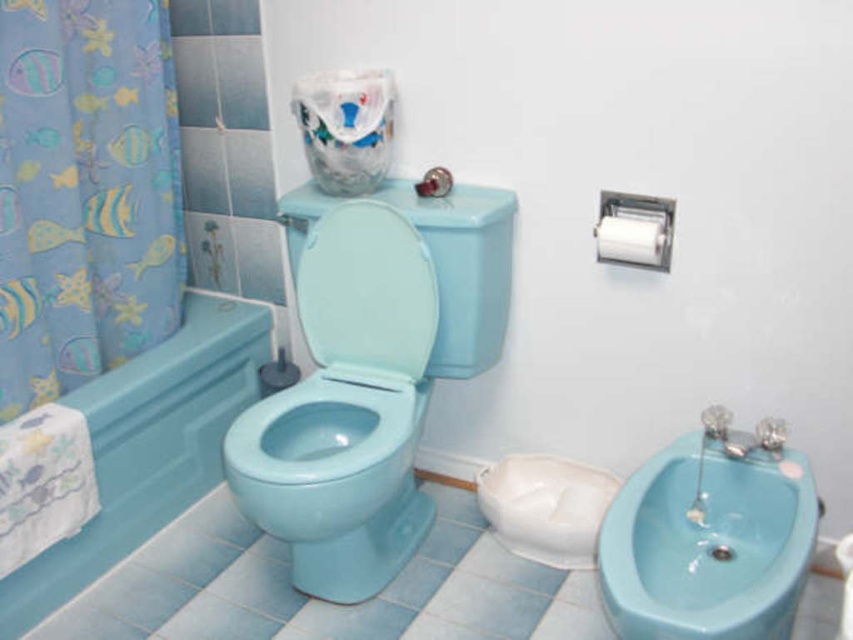
You are a plumber trying to install a new bidet. You have a space that can accommodate a width of 30 cm. According to the image, can the matte blue bidet at lower right fit in the space if the matte ceramic bathtub at lower left is 25 cm wide?

The matte blue bidet at lower right might be wider than the matte ceramic bathtub at lower left, which is 25 cm wide. Therefore, the bidet could be wider than 25 cm, so it may not fit in the 30 cm space unless its exact width is confirmed.

You are standing in the bathroom and need to locate the matte ceramic bathtub at lower left. According to the coordinates provided, where exactly is it positioned?

The matte ceramic bathtub at lower left is positioned at the 2D coordinates point (148, 445).

You are a bathroom designer planning to place a new rectangular shelf between the matte ceramic bathtub at lower left and the matte blue bidet at center. Considering their sizes, which object should the shelf be closer to to ensure it doesn

The matte ceramic bathtub at lower left is bigger than the matte blue bidet at center, so the shelf should be placed closer to the matte blue bidet at center to accommodate the larger size of the bathtub.